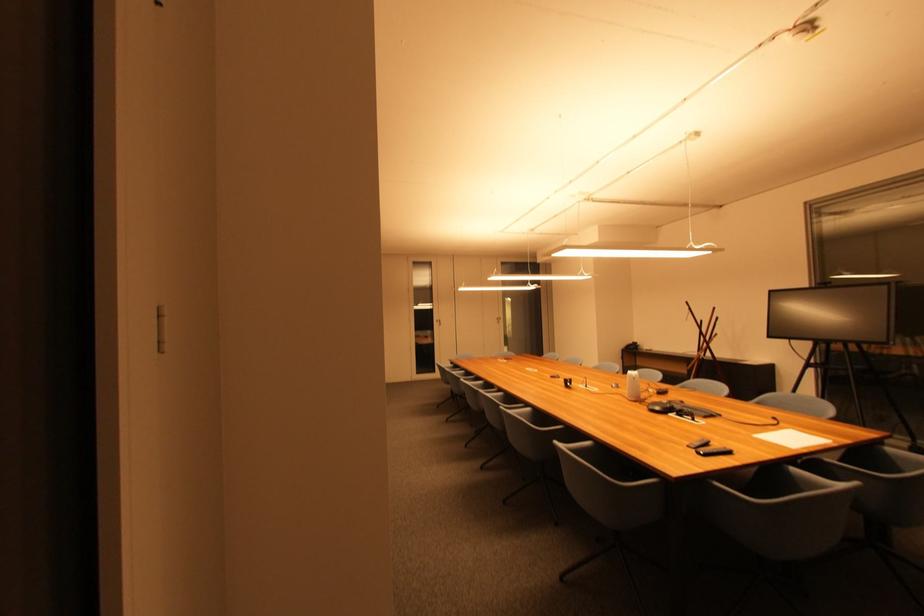
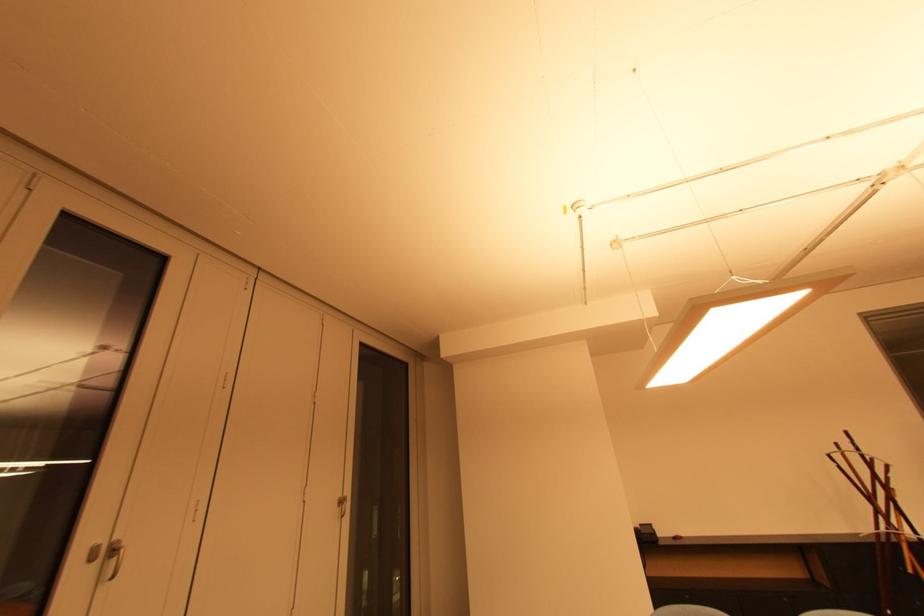
Find the pixel in the second image that matches the point at 504,321 in the first image.

(346, 504)